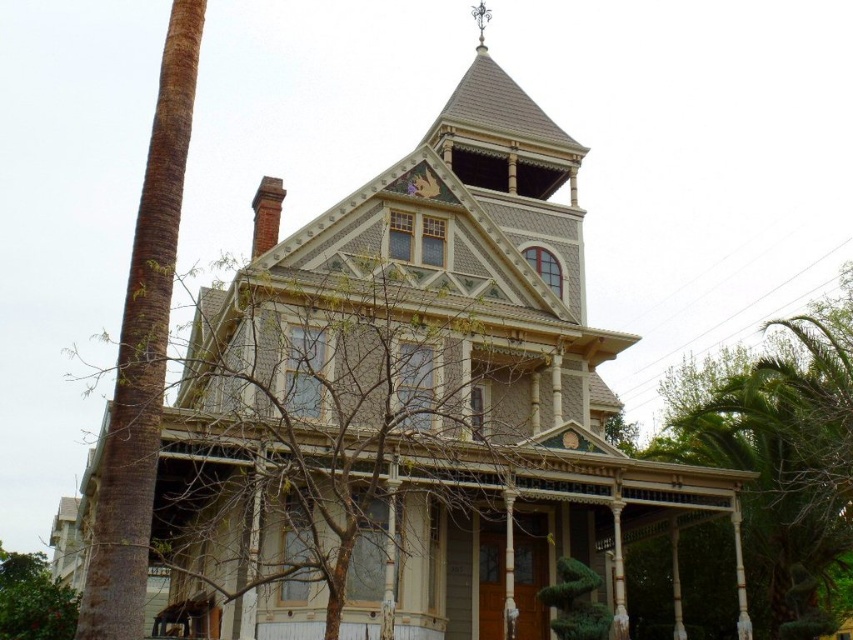
The width and height of the screenshot is (853, 640). What do you see at coordinates (412, 513) in the screenshot? I see `wooden porch at center` at bounding box center [412, 513].

Between wooden porch at center and green leafy tree at lower left, which one appears on the right side from the viewer's perspective?

wooden porch at center

Between point (258, 432) and point (30, 576), which one is positioned behind?

The point (30, 576) is more distant.

Locate an element on the screen. The image size is (853, 640). wooden porch at center is located at coordinates (412, 513).

Who is positioned more to the right, green leafy tree at lower right or green leafy tree at lower left?

green leafy tree at lower right is more to the right.

Locate an element on the screen. Image resolution: width=853 pixels, height=640 pixels. green leafy tree at lower right is located at coordinates (781, 461).

Which is behind, point (161, 538) or point (39, 586)?

Positioned behind is point (161, 538).

Is bare branches at upper center shorter than green leafy tree at lower left?

No.

What are the coordinates of `bare branches at upper center` in the screenshot? It's located at (332, 428).